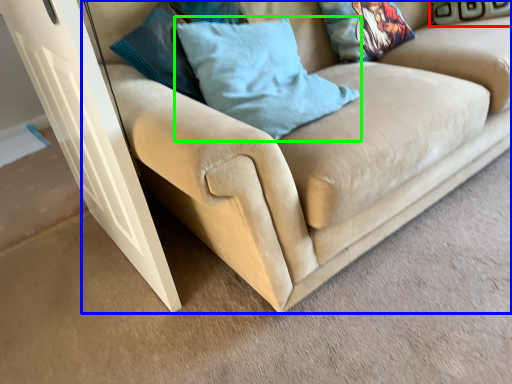
Question: Based on their relative distances, which object is nearer to pillow (highlighted by a red box)? Choose from studio couch (highlighted by a blue box) and pillow (highlighted by a green box).

Choices:
 (A) studio couch
 (B) pillow

Answer: (A)